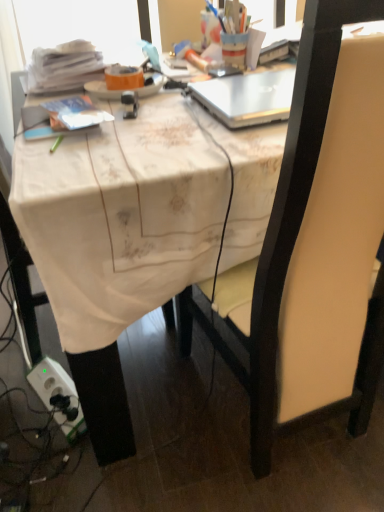
Question: From a real-world perspective, is white fabric-covered desk at center positioned over silver metallic laptop at upper center based on gravity?

Choices:
 (A) no
 (B) yes

Answer: (A)

Question: Does white fabric-covered desk at center have a larger size compared to silver metallic laptop at upper center?

Choices:
 (A) yes
 (B) no

Answer: (A)

Question: Is white fabric-covered desk at center placed right next to silver metallic laptop at upper center?

Choices:
 (A) no
 (B) yes

Answer: (A)

Question: Is white fabric-covered desk at center shorter than silver metallic laptop at upper center?

Choices:
 (A) yes
 (B) no

Answer: (B)

Question: Is white fabric-covered desk at center wider than silver metallic laptop at upper center?

Choices:
 (A) yes
 (B) no

Answer: (A)

Question: Is white fabric-covered desk at center to the left or to the right of orange matte plate at upper center in the image?

Choices:
 (A) right
 (B) left

Answer: (A)

Question: Considering the positions of white fabric-covered desk at center and orange matte plate at upper center in the image, is white fabric-covered desk at center wider or thinner than orange matte plate at upper center?

Choices:
 (A) wide
 (B) thin

Answer: (A)

Question: Considering the positions of white fabric-covered desk at center and orange matte plate at upper center in the image, is white fabric-covered desk at center taller or shorter than orange matte plate at upper center?

Choices:
 (A) tall
 (B) short

Answer: (A)

Question: Is point (87, 361) closer or farther from the camera than point (155, 81)?

Choices:
 (A) closer
 (B) farther

Answer: (A)

Question: From a real-world perspective, relative to orange matte plate at upper center, is matte black chair at center vertically above or below?

Choices:
 (A) above
 (B) below

Answer: (B)

Question: In the image, is matte black chair at center on the left side or the right side of orange matte plate at upper center?

Choices:
 (A) left
 (B) right

Answer: (B)

Question: Does point (271, 303) appear closer or farther from the camera than point (155, 90)?

Choices:
 (A) farther
 (B) closer

Answer: (B)

Question: In the image, is matte black chair at center positioned in front of or behind orange matte plate at upper center?

Choices:
 (A) behind
 (B) front

Answer: (B)

Question: Relative to silver metallic laptop at upper center, is white fabric-covered desk at center in front or behind?

Choices:
 (A) behind
 (B) front

Answer: (B)

Question: Based on their sizes in the image, would you say white fabric-covered desk at center is bigger or smaller than silver metallic laptop at upper center?

Choices:
 (A) small
 (B) big

Answer: (B)